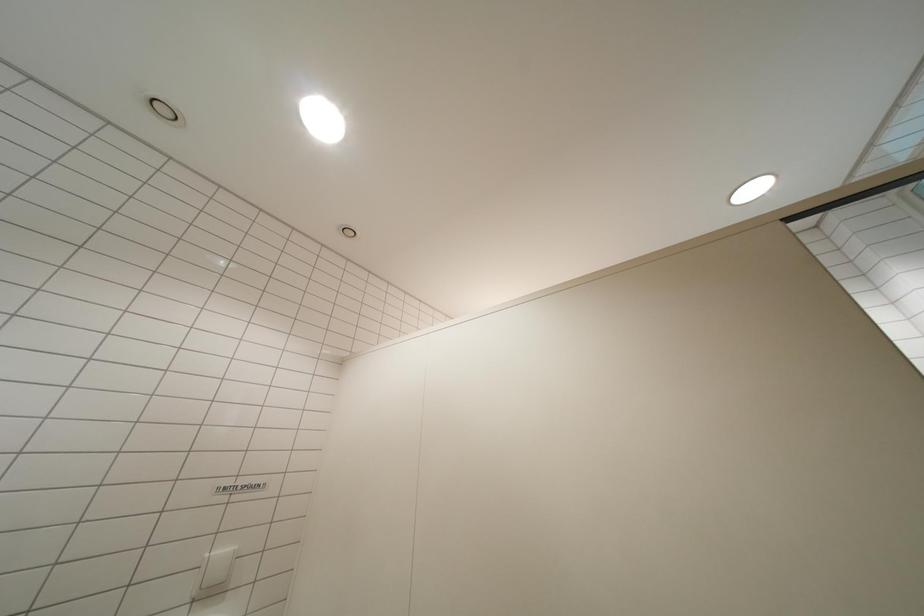
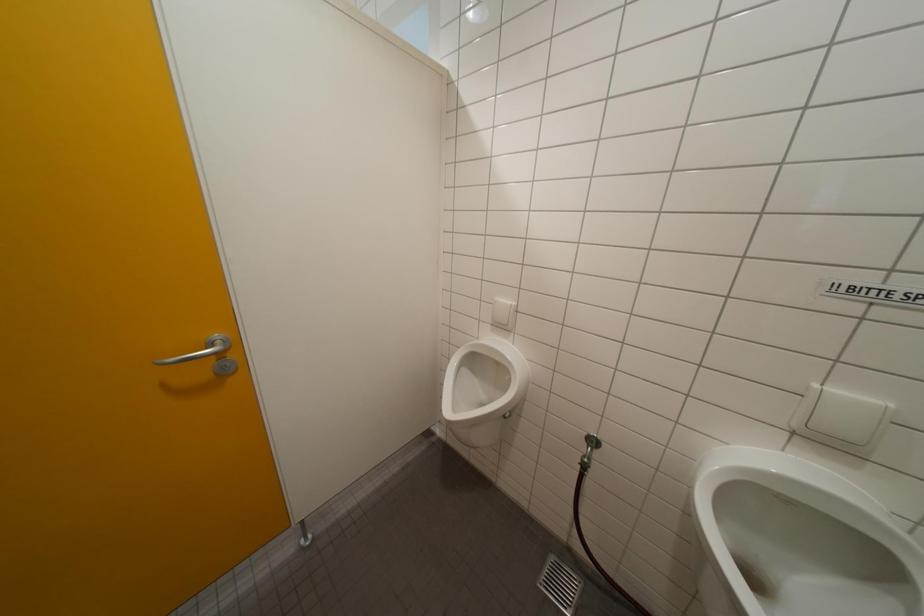
Question: The camera is either moving clockwise (left) or counter-clockwise (right) around the object. The first image is from the beginning of the video and the second image is from the end. Is the camera moving left or right when shooting the video?

Choices:
 (A) Left
 (B) Right

Answer: (B)